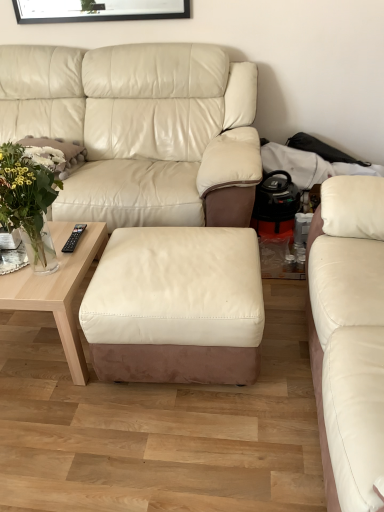
The image size is (384, 512). Identify the location of free point above light wood coffee table at lower left (from a real-world perspective). (57, 264).